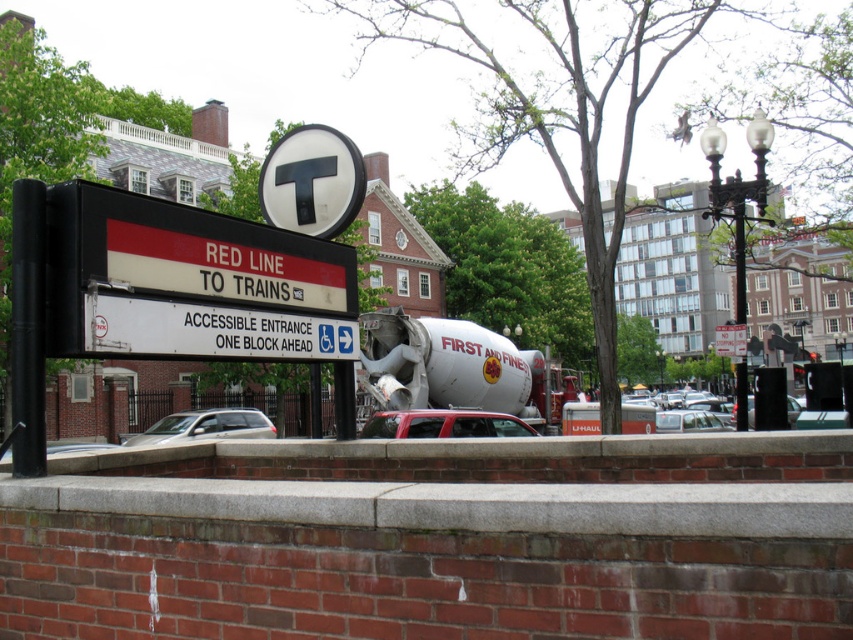
From the picture: You are a person who is 1.8 meters tall standing at the subway station sign. You see the metallic red car at center and the matte silver car at lower left. Which car do you think you can see the top of from your current position?

The metallic red car at center has a lesser height compared to matte silver car at lower left, so you can see the top of the metallic red car at center but not the matte silver car at lower left.

You are waiting at the subway station sign for the Red Line. You see a metallic silver car at center and a matte black car at center. Which car is closer to you?

The metallic silver car at center is closer to you because the matte black car at center is behind it.